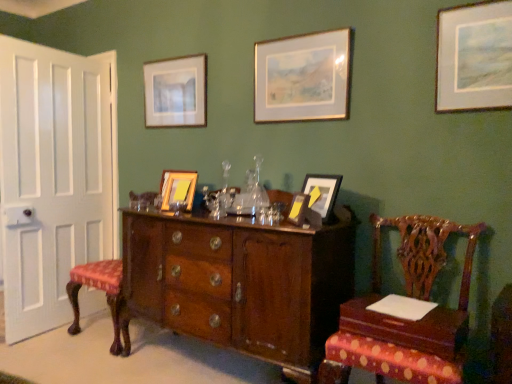
Question: Is polished wood chair at right, which is the 1th chair from right to left, thinner than wooden picture frame at center, the second picture frame from the back?

Choices:
 (A) yes
 (B) no

Answer: (B)

Question: Is polished wood chair at right, which is the 1th chair from right to left, further to camera compared to wooden picture frame at center, the 2th picture frame from the left?

Choices:
 (A) no
 (B) yes

Answer: (A)

Question: Considering the relative sizes of polished wood chair at right, positioned as the first chair in front-to-back order, and wooden picture frame at center, placed as the fifth picture frame when sorted from front to back, in the image provided, is polished wood chair at right, positioned as the first chair in front-to-back order, wider than wooden picture frame at center, placed as the fifth picture frame when sorted from front to back,?

Choices:
 (A) yes
 (B) no

Answer: (A)

Question: Is polished wood chair at right, placed as the second chair when sorted from back to front, positioned in front of wooden picture frame at center, the 2th picture frame from the left?

Choices:
 (A) no
 (B) yes

Answer: (B)

Question: Is polished wood chair at right, acting as the 2th chair starting from the left, placed right next to wooden picture frame at center, the 2th picture frame from the left?

Choices:
 (A) yes
 (B) no

Answer: (B)

Question: Is point (288, 49) positioned closer to the camera than point (394, 342)?

Choices:
 (A) farther
 (B) closer

Answer: (A)

Question: From a real-world perspective, relative to polished wood chair at right, positioned as the first chair in front-to-back order, is gold-framed picture at upper center, which is counted as the fourth picture frame, starting from the front, vertically above or below?

Choices:
 (A) above
 (B) below

Answer: (A)

Question: Is gold-framed picture at upper center, which is counted as the fourth picture frame, starting from the front, wider or thinner than polished wood chair at right, acting as the 2th chair starting from the left?

Choices:
 (A) thin
 (B) wide

Answer: (A)

Question: Looking at the image, does gold-framed picture at upper center, marked as the 3th picture frame in a right-to-left arrangement, seem bigger or smaller compared to polished wood chair at right, placed as the second chair when sorted from back to front?

Choices:
 (A) small
 (B) big

Answer: (A)

Question: Relative to matte gold picture frame at center, which is the 4th picture frame in right-to-left order, is wooden table at lower right in front or behind?

Choices:
 (A) front
 (B) behind

Answer: (A)

Question: Looking at their shapes, would you say wooden table at lower right is wider or thinner than matte gold picture frame at center, the fifth picture frame viewed from the back?

Choices:
 (A) thin
 (B) wide

Answer: (B)

Question: Is wooden table at lower right bigger or smaller than matte gold picture frame at center, which is the 4th picture frame in right-to-left order?

Choices:
 (A) small
 (B) big

Answer: (B)

Question: From the image's perspective, is wooden table at lower right above or below matte gold picture frame at center, positioned as the third picture frame in left-to-right order?

Choices:
 (A) below
 (B) above

Answer: (A)

Question: Based on their sizes in the image, would you say matte brown picture frame at center, which is the third picture frame in front-to-back order, is bigger or smaller than matte wooden picture frame at upper center, acting as the 6th picture frame starting from the front?

Choices:
 (A) big
 (B) small

Answer: (A)

Question: From a real-world perspective, is matte brown picture frame at center, the 2th picture frame in the right-to-left sequence, physically located above or below matte wooden picture frame at upper center, which ranks as the first picture frame in back-to-front order?

Choices:
 (A) above
 (B) below

Answer: (B)